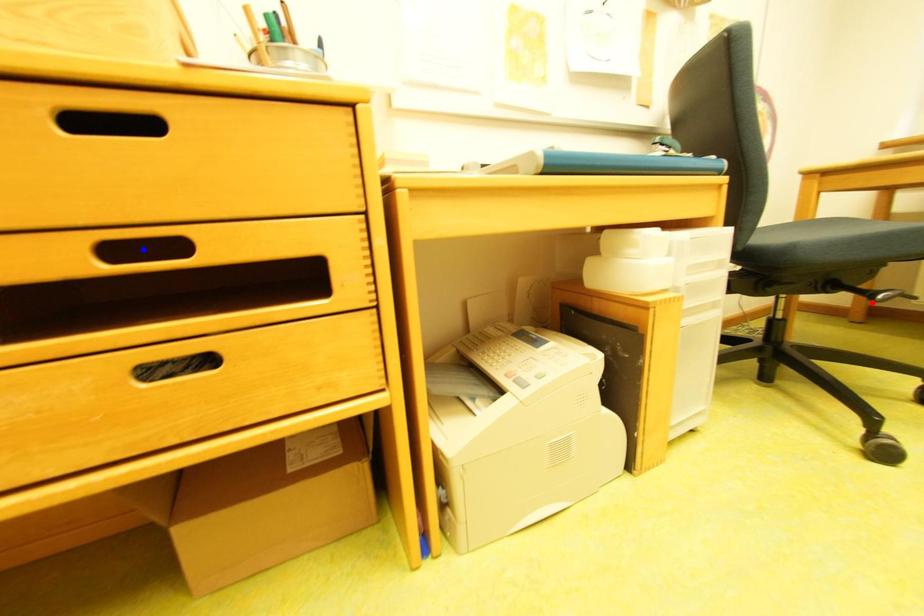
Question: Two points are marked on the image. Which point is closer to the camera?

Choices:
 (A) Blue point is closer.
 (B) Red point is closer.

Answer: (A)